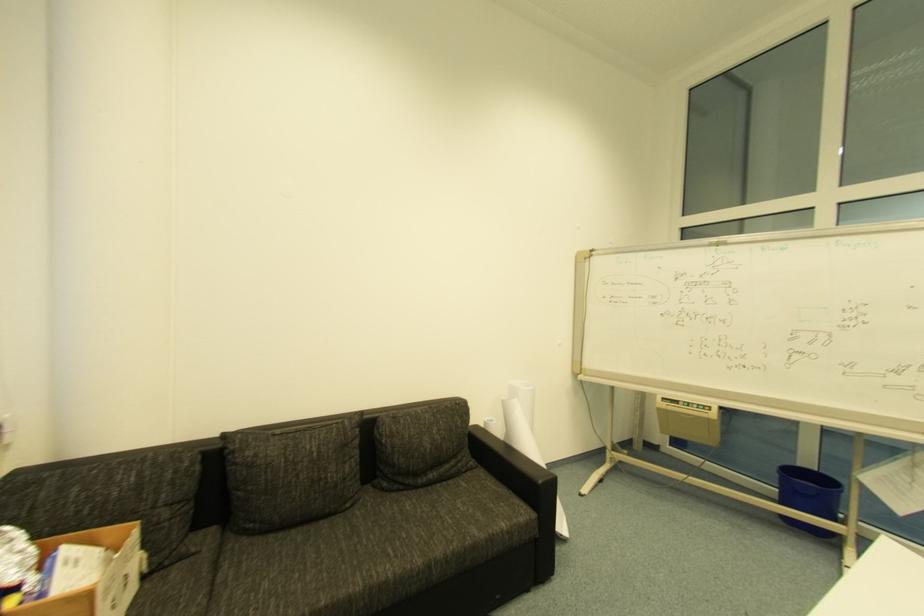
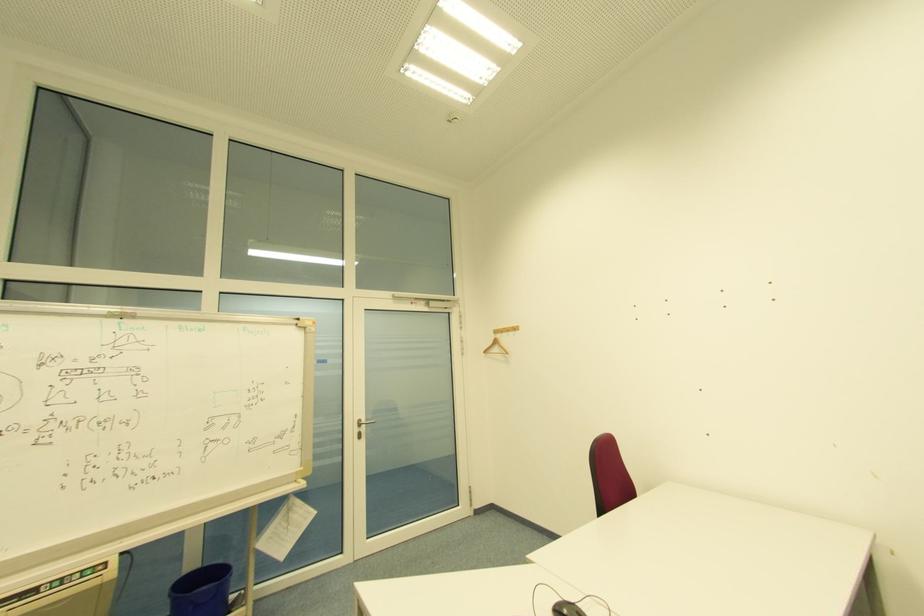
Question: Based on the continuous images, in which direction is the camera rotating? Reply with the corresponding letter.

Choices:
 (A) Left
 (B) Right
 (C) Up
 (D) Down

Answer: (B)